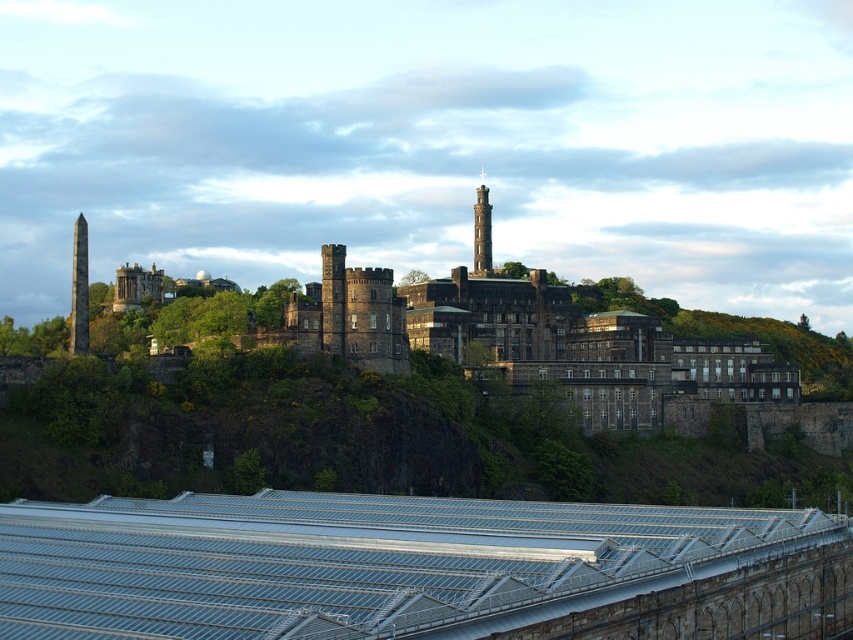
You are standing in the field near the castle and want to take a photo of both the brown stone obelisk at left and the smooth stone chimney at center. Can you frame both in the same shot without moving your camera position?

Yes, because the brown stone obelisk at left is in front of the smooth stone chimney at center, so they can be framed together in the same shot without needing to move the camera position.

You are standing at the base of the castle structure and looking towards the modern greenhouse. There is a point labeled as point (416, 570) in the image. Based on the scene description, what does this point most likely represent?

The point (416, 570) most likely represents the metallic gray roof at lower center, as stated in the objects description.